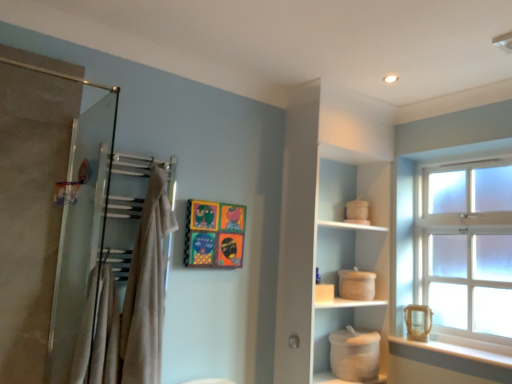
Question: Does clear glass window at upper right contain beige cotton bath towel at upper left, which is the second bath towel in left-to-right order?

Choices:
 (A) no
 (B) yes

Answer: (A)

Question: Does clear glass window at upper right appear on the right side of beige cotton bath towel at upper left, which is the second bath towel in left-to-right order?

Choices:
 (A) no
 (B) yes

Answer: (B)

Question: Considering the relative sizes of clear glass window at upper right and beige cotton bath towel at upper left, marked as the first bath towel in a right-to-left arrangement, in the image provided, is clear glass window at upper right smaller than beige cotton bath towel at upper left, marked as the first bath towel in a right-to-left arrangement,?

Choices:
 (A) yes
 (B) no

Answer: (B)

Question: Is clear glass window at upper right bigger than beige cotton bath towel at upper left, which is the second bath towel in left-to-right order?

Choices:
 (A) yes
 (B) no

Answer: (A)

Question: Can we say clear glass window at upper right lies outside beige cotton bath towel at upper left, which is the second bath towel in left-to-right order?

Choices:
 (A) no
 (B) yes

Answer: (B)

Question: Does clear glass window at upper right turn towards beige cotton bath towel at upper left, which is the second bath towel in left-to-right order?

Choices:
 (A) no
 (B) yes

Answer: (B)

Question: Considering the relative positions of beige cotton bath towel at left, acting as the second bath towel starting from the right, and clear glass window at upper right in the image provided, is beige cotton bath towel at left, acting as the second bath towel starting from the right, to the right of clear glass window at upper right from the viewer's perspective?

Choices:
 (A) no
 (B) yes

Answer: (A)

Question: Is beige cotton bath towel at left, which appears as the first bath towel when viewed from the left, next to clear glass window at upper right and touching it?

Choices:
 (A) yes
 (B) no

Answer: (B)

Question: Is beige cotton bath towel at left, acting as the second bath towel starting from the right, outside of clear glass window at upper right?

Choices:
 (A) yes
 (B) no

Answer: (A)

Question: From a real-world perspective, is beige cotton bath towel at left, which appears as the first bath towel when viewed from the left, beneath clear glass window at upper right?

Choices:
 (A) yes
 (B) no

Answer: (A)

Question: From the image's perspective, does beige cotton bath towel at left, which appears as the first bath towel when viewed from the left, appear higher than clear glass window at upper right?

Choices:
 (A) no
 (B) yes

Answer: (A)

Question: Does beige cotton bath towel at left, which appears as the first bath towel when viewed from the left, have a lesser width compared to clear glass window at upper right?

Choices:
 (A) no
 (B) yes

Answer: (A)

Question: Can you confirm if beige cotton bath towel at upper left, which is the second bath towel in left-to-right order, is bigger than beige cotton bath towel at left, acting as the second bath towel starting from the right?

Choices:
 (A) yes
 (B) no

Answer: (A)